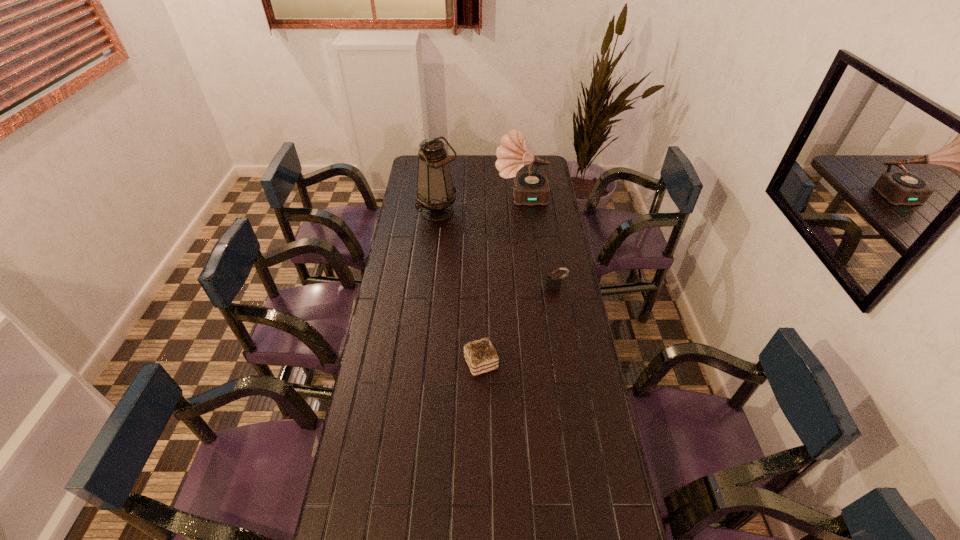
Image resolution: width=960 pixels, height=540 pixels. In order to click on vacant point that satisfies the following two spatial constraints: 1. from the horn of the record player; 2. on the front side of the oil lamp in this screenshot , I will do `click(523, 212)`.